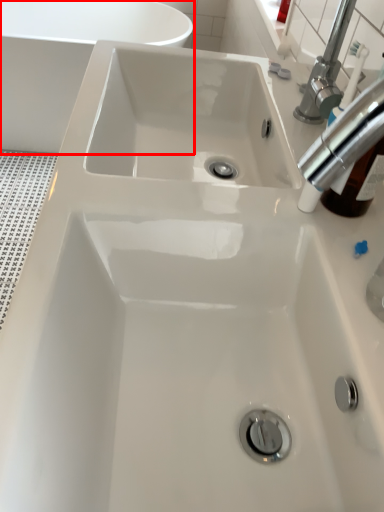
Question: From the image's perspective, what is the correct spatial positioning of bath (annotated by the red box) in reference to tap?

Choices:
 (A) above
 (B) below

Answer: (A)